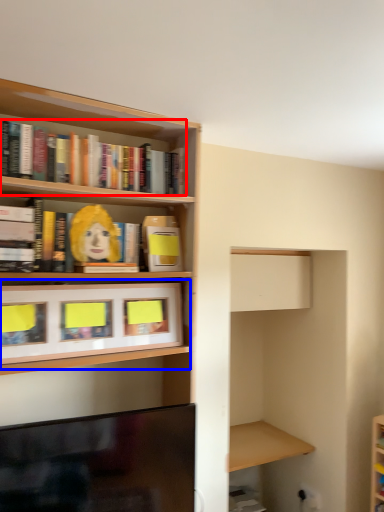
Question: Among these objects, which one is farthest to the camera, book (highlighted by a red box) or cabinet (highlighted by a blue box)?

Choices:
 (A) book
 (B) cabinet

Answer: (A)